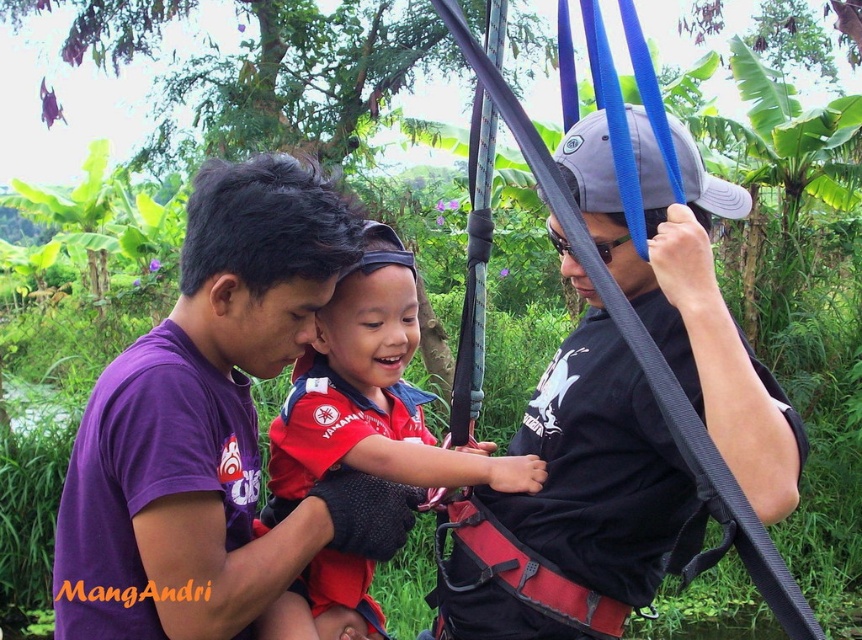
Can you confirm if purple cotton shirt at center is positioned above red matte life vest at center?

Correct, purple cotton shirt at center is located above red matte life vest at center.

Can you confirm if purple cotton shirt at center is shorter than red matte life vest at center?

No.

Between point (272, 337) and point (284, 616), which one is positioned behind?

The point (284, 616) is behind.

Locate an element on the screen. The height and width of the screenshot is (640, 862). purple cotton shirt at center is located at coordinates (201, 420).

Is purple cotton shirt at center wider than black fabric harness at center?

Incorrect, purple cotton shirt at center's width does not surpass black fabric harness at center's.

Who is positioned more to the right, purple cotton shirt at center or black fabric harness at center?

Positioned to the right is black fabric harness at center.

At what (x,y) coordinates should I click in order to perform the action: click on purple cotton shirt at center. Please return your answer as a coordinate pair (x, y). The width and height of the screenshot is (862, 640). Looking at the image, I should click on (201, 420).

Identify the location of purple cotton shirt at center. The image size is (862, 640). (201, 420).

Is black fabric harness at center thinner than red matte life vest at center?

No.

Consider the image. Does black fabric harness at center have a lesser height compared to red matte life vest at center?

No.

Is point (564, 387) farther from viewer compared to point (348, 618)?

No, it is in front of (348, 618).

This screenshot has height=640, width=862. In order to click on black fabric harness at center in this screenshot , I will do `click(597, 461)`.